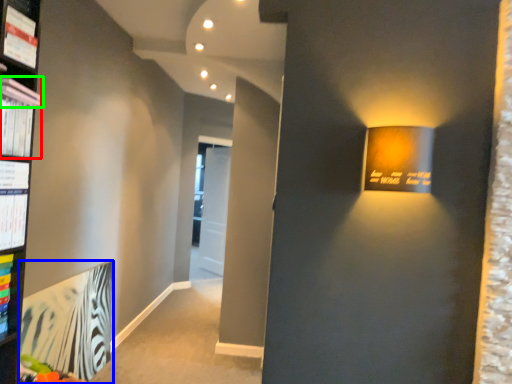
Question: Which object is positioned closest to magazine (highlighted by a red box)? Select from paperback book (highlighted by a blue box) and book (highlighted by a green box).

Choices:
 (A) paperback book
 (B) book

Answer: (B)